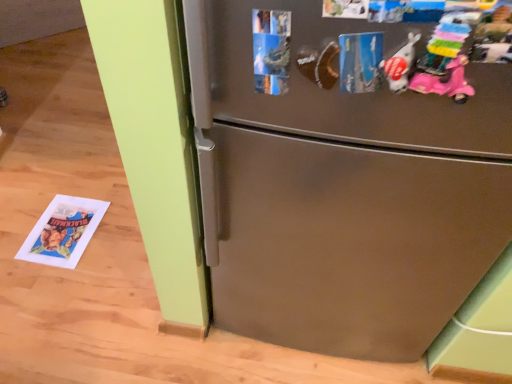
Question: Is stainless steel refrigerator at center thinner than pastel plastic toy at upper right, which is counted as the second toy, starting from the left?

Choices:
 (A) no
 (B) yes

Answer: (A)

Question: Is stainless steel refrigerator at center directly adjacent to pastel plastic toy at upper right, which is counted as the second toy, starting from the left?

Choices:
 (A) no
 (B) yes

Answer: (A)

Question: Is pastel plastic toy at upper right, which is counted as the second toy, starting from the left, located within stainless steel refrigerator at center?

Choices:
 (A) no
 (B) yes

Answer: (A)

Question: From the image's perspective, does stainless steel refrigerator at center appear lower than pastel plastic toy at upper right, the 1th toy in the right-to-left sequence?

Choices:
 (A) no
 (B) yes

Answer: (B)

Question: Is stainless steel refrigerator at center behind pastel plastic toy at upper right, the 1th toy in the right-to-left sequence?

Choices:
 (A) no
 (B) yes

Answer: (B)

Question: From the image's perspective, is stainless steel refrigerator at center on pastel plastic toy at upper right, which is counted as the second toy, starting from the left?

Choices:
 (A) no
 (B) yes

Answer: (A)

Question: Can you confirm if stainless steel refrigerator at center is taller than white matte plush toy at upper right, which is the second toy in right-to-left order?

Choices:
 (A) yes
 (B) no

Answer: (B)

Question: Considering the relative sizes of stainless steel refrigerator at center and white matte plush toy at upper right, which ranks as the 1th toy in left-to-right order, in the image provided, is stainless steel refrigerator at center wider than white matte plush toy at upper right, which ranks as the 1th toy in left-to-right order,?

Choices:
 (A) yes
 (B) no

Answer: (A)

Question: Considering the relative sizes of stainless steel refrigerator at center and white matte plush toy at upper right, which is the second toy in right-to-left order, in the image provided, is stainless steel refrigerator at center smaller than white matte plush toy at upper right, which is the second toy in right-to-left order,?

Choices:
 (A) no
 (B) yes

Answer: (A)

Question: Is stainless steel refrigerator at center oriented away from white matte plush toy at upper right, which is the second toy in right-to-left order?

Choices:
 (A) yes
 (B) no

Answer: (B)

Question: Is stainless steel refrigerator at center positioned before white matte plush toy at upper right, which ranks as the 1th toy in left-to-right order?

Choices:
 (A) yes
 (B) no

Answer: (B)

Question: Can white matte plush toy at upper right, which is the second toy in right-to-left order, be found inside stainless steel refrigerator at center?

Choices:
 (A) no
 (B) yes

Answer: (A)

Question: From a real-world perspective, is pastel plastic toy at upper right, the 1th toy in the right-to-left sequence, physically below white matte plush toy at upper right, which ranks as the 1th toy in left-to-right order?

Choices:
 (A) no
 (B) yes

Answer: (A)